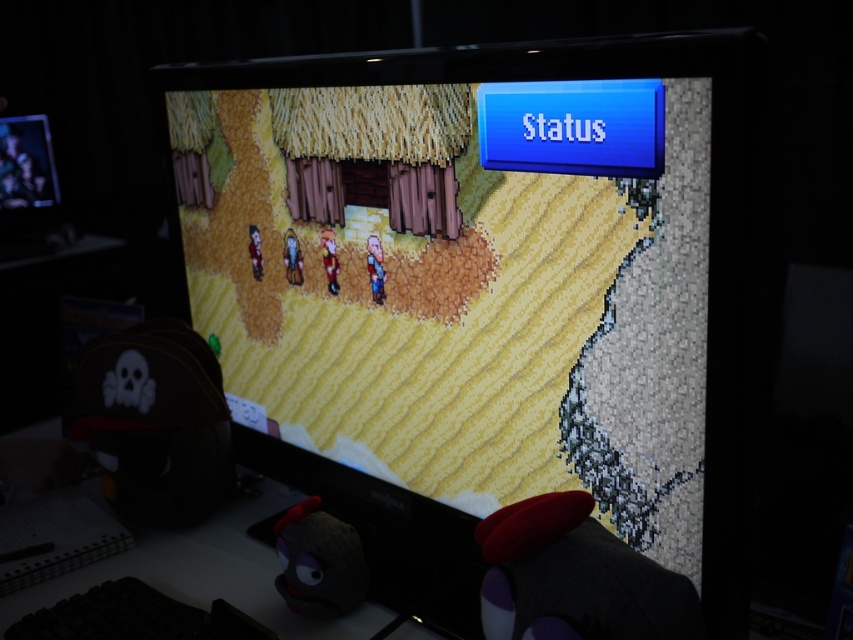
You are a game developer working on a fantasy RPG. You want to ensure that the main game screen is visible to players while keeping the status menu accessible. Given the current setup with the matte black monitor at center and the matte black monitor at upper left, which monitor should the game developers place the village scene on to ensure it is in the foreground?

The matte black monitor at center is in front of the matte black monitor at upper left, so the game developers should place the village scene on the matte black monitor at center to ensure it is in the foreground.

You are a gamer who wants to check the game status. The game is displayed on the matte black monitor at center and the matte black monitor at upper left. Which monitor should you look at to see the Status menu?

The Status menu is located in the upper right corner of the screen, so you should look at the matte black monitor at upper left to see the Status menu because it is positioned closer to the upper right corner of the screen.